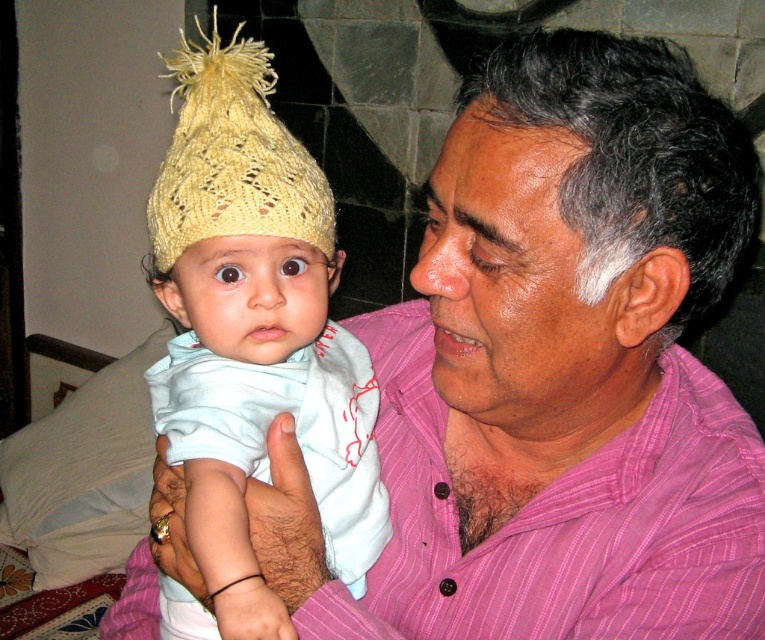
You are a photographer setting up for a family portrait. You notice two knitted yellow hats in the scene. Which one is taller? The knitted yellow hat at left or the yellow knitted hat at upper left?

The knitted yellow hat at left is taller than the yellow knitted hat at upper left according to the description provided.

You are a photographer trying to capture the baby in the image. You notice two points marked in the scene. The first point is at coordinate point (213, 428) and the second point is at coordinate point (311, 221). Which point is closer to the camera?

Point (213, 428) is in front of point (311, 221), so the first point is closer to the camera.